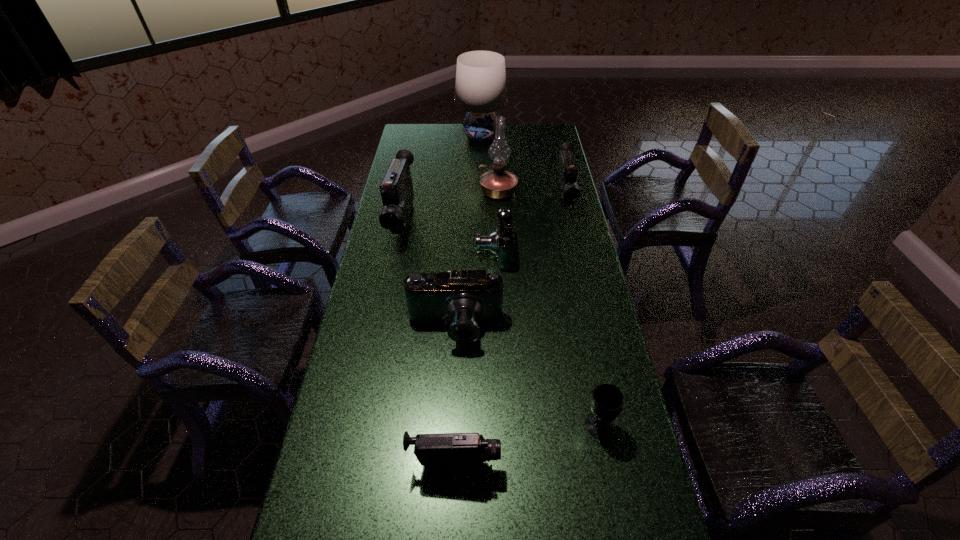
This screenshot has height=540, width=960. In order to click on the nearest camcorder in this screenshot , I will do `click(464, 450)`.

You are a GUI agent. You are given a task and a screenshot of the screen. Output one action in this format:
    pyautogui.click(x=<x>, y=<y>)
    Task: Click on the chalice
    This screenshot has width=960, height=540.
    Given the screenshot: What is the action you would take?
    pyautogui.click(x=607, y=400)

Identify the location of the farther blue camcorder. (501, 242).

The width and height of the screenshot is (960, 540). Find the location of `vacant space located on the front-facing side of the lampshade`. vacant space located on the front-facing side of the lampshade is located at coordinates [x=405, y=137].

The width and height of the screenshot is (960, 540). In order to click on free region located on the front-facing side of the lampshade in this screenshot , I will do `click(409, 137)`.

Locate an element on the screen. vacant space located on the front-facing side of the lampshade is located at coordinates (424, 137).

Locate an element on the screen. The width and height of the screenshot is (960, 540). blank space located on the front of the oil lamp is located at coordinates (501, 255).

Image resolution: width=960 pixels, height=540 pixels. What are the coordinates of `vacant space located on the front-facing side of the leftmost camcorder` in the screenshot? It's located at (392, 276).

In order to click on vacant space located on the front-facing side of the second smallest black camcorder in this screenshot , I will do (x=575, y=240).

Where is `vacant space situated on the front-facing side of the bigger blue camcorder`? vacant space situated on the front-facing side of the bigger blue camcorder is located at coordinates (451, 406).